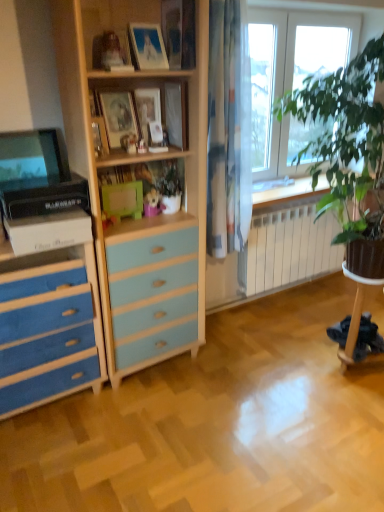
Measure the distance between point [25,134] and camera.

Point [25,134] and camera are 2.01 meters apart from each other.

What do you see at coordinates (147, 110) in the screenshot? Image resolution: width=384 pixels, height=512 pixels. I see `matte wooden picture frame at center, which is counted as the 1th picture frame, starting from the back` at bounding box center [147, 110].

In order to face matte wooden picture frame at center, which ranks as the 3th picture frame in front-to-back order, should I rotate leftwards or rightwards?

Turn left approximately 5.891 degrees to face it.

The image size is (384, 512). What do you see at coordinates (133, 79) in the screenshot? I see `wooden picture frames at upper center` at bounding box center [133, 79].

Where is `matte black monitor at left`? matte black monitor at left is located at coordinates (31, 160).

Could you tell me if matte wooden picture frame at upper center, which ranks as the 2th picture frame in front-to-back order, is turned towards wooden picture frames at upper center?

No, matte wooden picture frame at upper center, which ranks as the 2th picture frame in front-to-back order, is not facing towards wooden picture frames at upper center.

Is point (153, 60) more distant than point (137, 78)?

No, it is not.

Is white metallic radiator at lower right to the right of wooden picture frames at upper center from the viewer's perspective?

Indeed, white metallic radiator at lower right is positioned on the right side of wooden picture frames at upper center.

This screenshot has height=512, width=384. I want to click on radiator located behind the wooden picture frames at upper center, so click(x=288, y=248).

Can you tell me how much white metallic radiator at lower right and wooden picture frames at upper center differ in facing direction?

white metallic radiator at lower right and wooden picture frames at upper center are facing 1.2 degrees away from each other.

Is white metallic radiator at lower right situated inside wooden picture frames at upper center or outside?

white metallic radiator at lower right is located beyond the bounds of wooden picture frames at upper center.

Between blue painted wood chest of drawers at left and matte wooden picture frame at upper center, which ranks as the 2th picture frame in front-to-back order, which one appears on the right side from the viewer's perspective?

Positioned to the right is matte wooden picture frame at upper center, which ranks as the 2th picture frame in front-to-back order.

Where is `chest of drawers below the matte wooden picture frame at upper center, which ranks as the 2th picture frame in front-to-back order (from the image's perspective)`? The height and width of the screenshot is (512, 384). chest of drawers below the matte wooden picture frame at upper center, which ranks as the 2th picture frame in front-to-back order (from the image's perspective) is located at coordinates click(x=49, y=327).

Does blue painted wood chest of drawers at left have a greater width compared to matte wooden picture frame at upper center, the 2th picture frame in the back-to-front sequence?

Correct, the width of blue painted wood chest of drawers at left exceeds that of matte wooden picture frame at upper center, the 2th picture frame in the back-to-front sequence.

Is white metallic radiator at lower right in front of or behind matte black monitor at left in the image?

white metallic radiator at lower right is behind matte black monitor at left.

Which of these two, white metallic radiator at lower right or matte black monitor at left, is wider?

With larger width is white metallic radiator at lower right.

Is white metallic radiator at lower right situated inside matte black monitor at left or outside?

white metallic radiator at lower right is outside matte black monitor at left.

Could you tell me if white metallic radiator at lower right is facing matte black monitor at left?

No.

Which object is further away from the camera taking this photo, matte wooden picture frame at upper center, the 2th picture frame in the back-to-front sequence, or matte wooden picture frame at center, which ranks as the 3th picture frame in front-to-back order?

Positioned behind is matte wooden picture frame at center, which ranks as the 3th picture frame in front-to-back order.

Who is bigger, matte wooden picture frame at upper center, the 2th picture frame in the back-to-front sequence, or matte wooden picture frame at center, which is counted as the 1th picture frame, starting from the back?

With larger size is matte wooden picture frame at upper center, the 2th picture frame in the back-to-front sequence.

Is matte wooden picture frame at center, which ranks as the 3th picture frame in front-to-back order, at the back of matte wooden picture frame at upper center, the 2th picture frame in the back-to-front sequence?

That's not correct — matte wooden picture frame at upper center, the 2th picture frame in the back-to-front sequence, is not looking away from matte wooden picture frame at center, which ranks as the 3th picture frame in front-to-back order.

Could matte wooden picture frame at center, which is counted as the 1th picture frame, starting from the back, be considered to be inside matte glass picture frame at upper center, which ranks as the 1th picture frame in front-to-back order?

Definitely not — matte wooden picture frame at center, which is counted as the 1th picture frame, starting from the back, is not inside matte glass picture frame at upper center, which ranks as the 1th picture frame in front-to-back order.

Between matte glass picture frame at upper center, which ranks as the 1th picture frame in front-to-back order, and matte wooden picture frame at center, which ranks as the 3th picture frame in front-to-back order, which one has smaller size?

matte wooden picture frame at center, which ranks as the 3th picture frame in front-to-back order.

Is matte glass picture frame at upper center, which ranks as the third picture frame in back-to-front order, aimed at matte wooden picture frame at center, which is counted as the 1th picture frame, starting from the back?

No, matte glass picture frame at upper center, which ranks as the third picture frame in back-to-front order, is not oriented towards matte wooden picture frame at center, which is counted as the 1th picture frame, starting from the back.

From the image's perspective, which one is positioned lower, matte glass picture frame at upper center, which ranks as the third picture frame in back-to-front order, or matte wooden picture frame at center, which ranks as the 3th picture frame in front-to-back order?

matte wooden picture frame at center, which ranks as the 3th picture frame in front-to-back order, appears lower in the image.

Could you tell me if matte glass picture frame at upper center, which ranks as the 1th picture frame in front-to-back order, is turned towards blue painted wood chest of drawers at left?

No, matte glass picture frame at upper center, which ranks as the 1th picture frame in front-to-back order, is not aimed at blue painted wood chest of drawers at left.

The image size is (384, 512). I want to click on chest of drawers that appears on the left of matte glass picture frame at upper center, which ranks as the 1th picture frame in front-to-back order, so click(x=49, y=327).

From a real-world perspective, is matte glass picture frame at upper center, which ranks as the 1th picture frame in front-to-back order, on blue painted wood chest of drawers at left?

Indeed, from a real-world perspective, matte glass picture frame at upper center, which ranks as the 1th picture frame in front-to-back order, stands above blue painted wood chest of drawers at left.

Considering the sizes of objects matte glass picture frame at upper center, which ranks as the 1th picture frame in front-to-back order, and blue painted wood chest of drawers at left in the image provided, who is wider, matte glass picture frame at upper center, which ranks as the 1th picture frame in front-to-back order, or blue painted wood chest of drawers at left?

With larger width is blue painted wood chest of drawers at left.

The width and height of the screenshot is (384, 512). I want to click on shelf that appears below the matte wooden picture frame at upper center, the 2th picture frame in the back-to-front sequence (from a real-world perspective), so click(x=133, y=79).

The height and width of the screenshot is (512, 384). What are the coordinates of `radiator on the right of wooden picture frames at upper center` in the screenshot? It's located at (288, 248).

When comparing their distances from blue painted wood chest of drawers at left, does white metallic radiator at lower right or matte black monitor at left seem closer?

Based on the image, matte black monitor at left appears to be nearer to blue painted wood chest of drawers at left.

Considering their positions, is white metallic radiator at lower right positioned closer to matte glass picture frame at upper center, which ranks as the 1th picture frame in front-to-back order, than matte black monitor at left?

Based on the image, matte black monitor at left appears to be nearer to matte glass picture frame at upper center, which ranks as the 1th picture frame in front-to-back order.

Estimate the real-world distances between objects in this image. Which object is further from white metallic radiator at lower right, matte wooden picture frame at upper center, the 2th picture frame in the back-to-front sequence, or blue painted wood chest of drawers at left?

matte wooden picture frame at upper center, the 2th picture frame in the back-to-front sequence, is positioned further to the anchor white metallic radiator at lower right.

Which object lies nearer to the anchor point blue painted wood chest of drawers at left, matte wooden picture frame at upper center, the 2th picture frame in the back-to-front sequence, or matte glass picture frame at upper center, which ranks as the third picture frame in back-to-front order?

The object closer to blue painted wood chest of drawers at left is matte glass picture frame at upper center, which ranks as the third picture frame in back-to-front order.

Which object lies further to the anchor point matte wooden picture frame at upper center, the 2th picture frame in the back-to-front sequence, wooden picture frames at upper center or matte black monitor at left?

Based on the image, matte black monitor at left appears to be further to matte wooden picture frame at upper center, the 2th picture frame in the back-to-front sequence.

Estimate the real-world distances between objects in this image. Which object is further from matte black monitor at left, wooden picture frames at upper center or white metallic radiator at lower right?

Based on the image, white metallic radiator at lower right appears to be further to matte black monitor at left.

When comparing their distances from matte black monitor at left, does matte wooden picture frame at center, which ranks as the 3th picture frame in front-to-back order, or matte glass picture frame at upper center, which ranks as the third picture frame in back-to-front order, seem closer?

matte glass picture frame at upper center, which ranks as the third picture frame in back-to-front order, lies closer to matte black monitor at left than the other object.

Looking at the image, which one is located closer to blue painted wood chest of drawers at left, matte wooden picture frame at center, which is counted as the 1th picture frame, starting from the back, or matte wooden picture frame at upper center, the 2th picture frame in the back-to-front sequence?

matte wooden picture frame at center, which is counted as the 1th picture frame, starting from the back, is closer to blue painted wood chest of drawers at left.

The image size is (384, 512). Find the location of `computer monitor that lies between matte glass picture frame at upper center, which ranks as the third picture frame in back-to-front order, and blue painted wood chest of drawers at left from top to bottom`. computer monitor that lies between matte glass picture frame at upper center, which ranks as the third picture frame in back-to-front order, and blue painted wood chest of drawers at left from top to bottom is located at coordinates (31, 160).

I want to click on computer monitor located between blue painted wood chest of drawers at left and white metallic radiator at lower right in the left-right direction, so tap(31, 160).

The height and width of the screenshot is (512, 384). What are the coordinates of `shelf between matte wooden picture frame at upper center, which ranks as the 2th picture frame in front-to-back order, and blue painted wood chest of drawers at left in the up-down direction` in the screenshot? It's located at (133, 79).

Where is `picture frame between matte glass picture frame at upper center, which ranks as the third picture frame in back-to-front order, and blue painted wood chest of drawers at left in the up-down direction`? The width and height of the screenshot is (384, 512). picture frame between matte glass picture frame at upper center, which ranks as the third picture frame in back-to-front order, and blue painted wood chest of drawers at left in the up-down direction is located at coordinates pos(147,110).